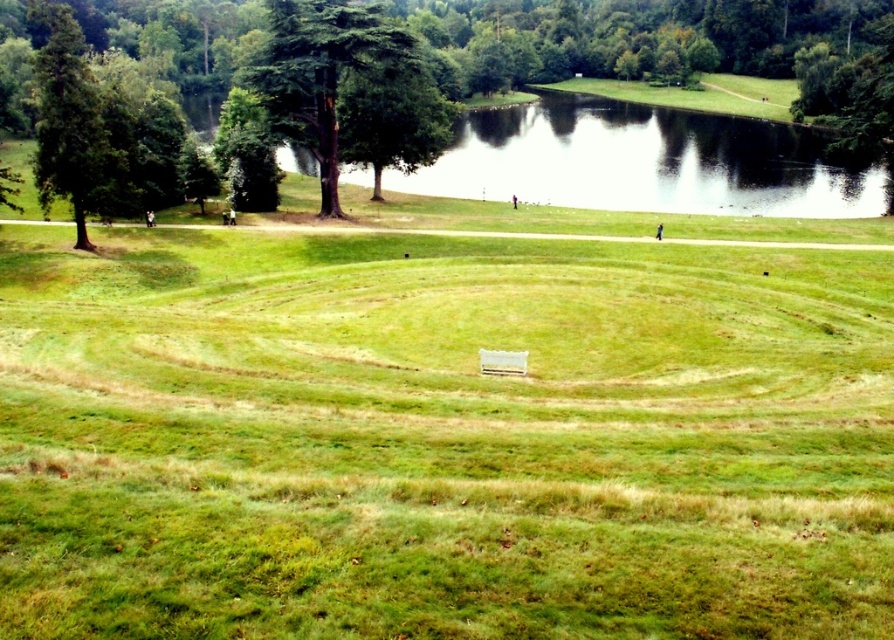
Which of these two, green leafy tree at center or green matte tree at left, stands shorter?

Standing shorter between the two is green leafy tree at center.

Locate an element on the screen. The width and height of the screenshot is (894, 640). green leafy tree at center is located at coordinates (348, 88).

Is green leafy tree at upper left wider than green leafy tree at center?

Correct, the width of green leafy tree at upper left exceeds that of green leafy tree at center.

Who is positioned more to the right, green leafy tree at upper left or green leafy tree at center?

green leafy tree at center is more to the right.

Between point (881, 161) and point (327, 209), which one is positioned in front?

Point (327, 209) is in front.

You are a GUI agent. You are given a task and a screenshot of the screen. Output one action in this format:
    pyautogui.click(x=<x>, y=<y>)
    Task: Click on the green leafy tree at upper left
    
    Given the screenshot: What is the action you would take?
    pyautogui.click(x=409, y=81)

Can you confirm if green leafy tree at upper left is positioned to the left of green matte tree at left?

Incorrect, green leafy tree at upper left is not on the left side of green matte tree at left.

Does point (704, 67) come closer to viewer compared to point (76, 193)?

No, it is not.

Who is more distant from viewer, (477, 76) or (77, 100)?

The point (477, 76) is behind.

Where is `green leafy tree at upper left`? green leafy tree at upper left is located at coordinates (409, 81).